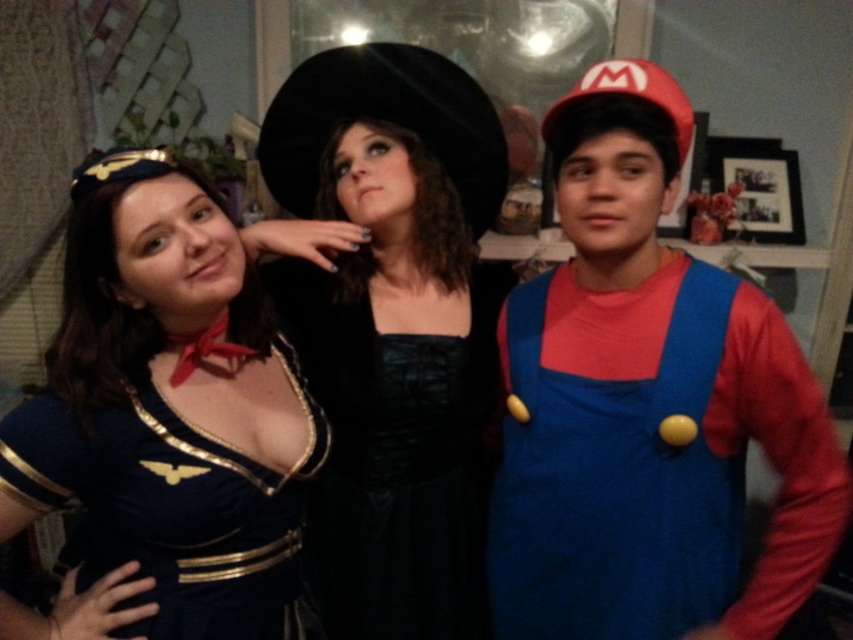
Question: From the image, what is the correct spatial relationship of velvet black dress at center in relation to shiny blue fabric dress at center?

Choices:
 (A) right
 (B) left

Answer: (A)

Question: Which point appears closest to the camera in this image?

Choices:
 (A) (566, 314)
 (B) (380, 307)
 (C) (113, 436)

Answer: (C)

Question: Which point is closer to the camera?

Choices:
 (A) (320, 392)
 (B) (572, 353)

Answer: (B)

Question: Is shiny blue fabric dress at center positioned at the back of blue fabric overalls at right?

Choices:
 (A) yes
 (B) no

Answer: (B)

Question: Which of the following is the farthest from the observer?

Choices:
 (A) black satin dress at center
 (B) shiny blue fabric dress at center
 (C) blue fabric overalls at right

Answer: (A)

Question: Does velvet black dress at center appear on the left side of shiny blue fabric dress at center?

Choices:
 (A) yes
 (B) no

Answer: (B)